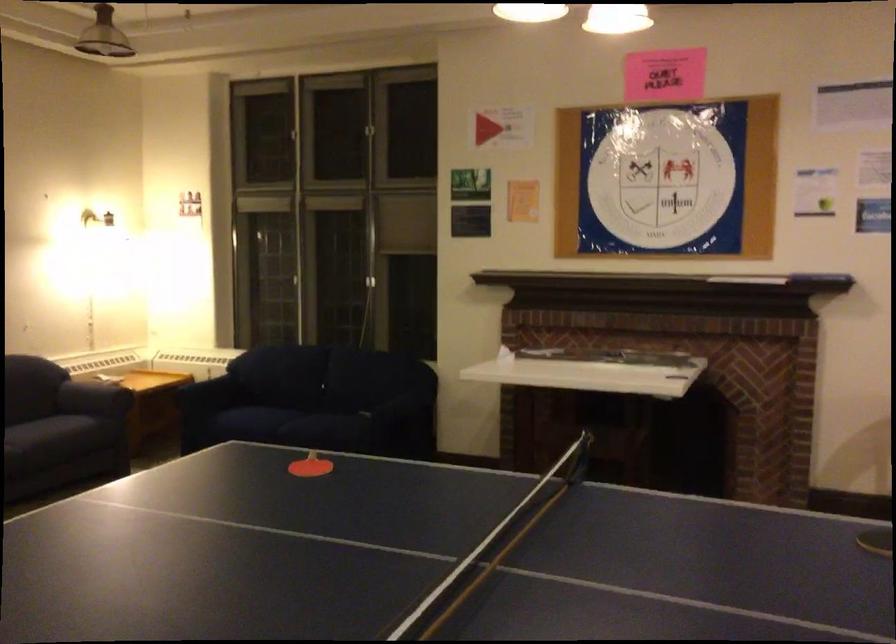
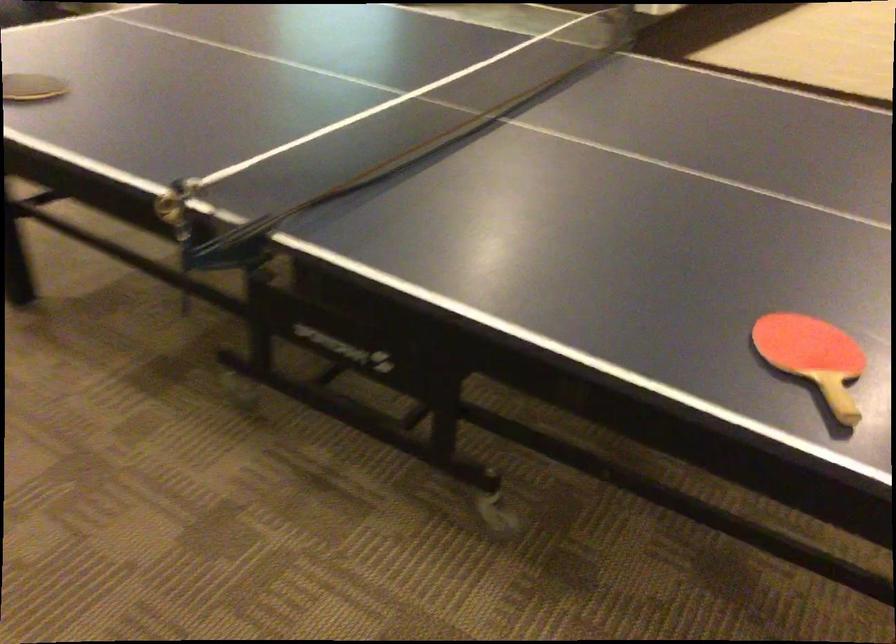
In the second image, find the point that corresponds to point (307, 480) in the first image.

(813, 357)